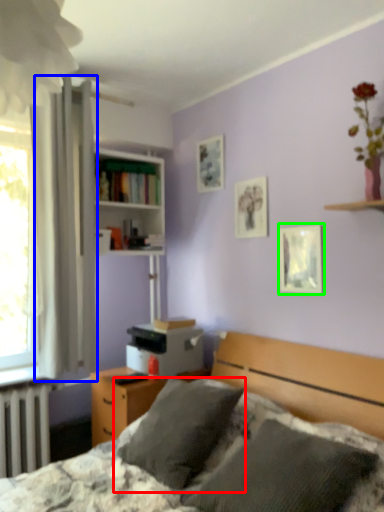
Question: Estimate the real-world distances between objects in this image. Which object is closer to pillow (highlighted by a red box), curtain (highlighted by a blue box) or picture frame (highlighted by a green box)?

Choices:
 (A) curtain
 (B) picture frame

Answer: (B)